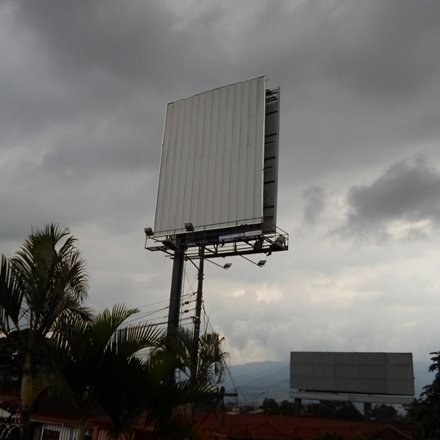
The width and height of the screenshot is (440, 440). I want to click on board, so click(x=245, y=151).